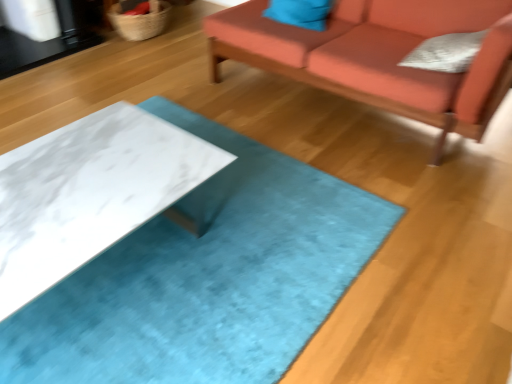
Question: Is matte blue pillow at upper center, which is the second pillow from right to left, closer to camera compared to white marble table at center?

Choices:
 (A) yes
 (B) no

Answer: (B)

Question: Does matte blue pillow at upper center, which appears as the 1th pillow when viewed from the left, appear on the right side of white marble table at center?

Choices:
 (A) no
 (B) yes

Answer: (B)

Question: Can you confirm if matte blue pillow at upper center, positioned as the 2th pillow in front-to-back order, is shorter than white marble table at center?

Choices:
 (A) yes
 (B) no

Answer: (A)

Question: Is matte blue pillow at upper center, which ranks as the first pillow in back-to-front order, behind white marble table at center?

Choices:
 (A) yes
 (B) no

Answer: (A)

Question: Is matte blue pillow at upper center, which is counted as the second pillow, starting from the bottom, oriented away from white marble table at center?

Choices:
 (A) no
 (B) yes

Answer: (A)

Question: From a real-world perspective, is matte blue pillow at upper center, which ranks as the first pillow in back-to-front order, on top of white marble table at center?

Choices:
 (A) no
 (B) yes

Answer: (B)

Question: Does white textured pillow at upper right, the 1th pillow positioned from the front, turn towards velvet orange couch at upper right?

Choices:
 (A) no
 (B) yes

Answer: (B)

Question: Considering the relative sizes of white textured pillow at upper right, which ranks as the 2th pillow in top-to-bottom order, and velvet orange couch at upper right in the image provided, is white textured pillow at upper right, which ranks as the 2th pillow in top-to-bottom order, wider than velvet orange couch at upper right?

Choices:
 (A) no
 (B) yes

Answer: (A)

Question: Would you say velvet orange couch at upper right is part of white textured pillow at upper right, the 2th pillow positioned from the left,'s contents?

Choices:
 (A) no
 (B) yes

Answer: (A)

Question: Is white textured pillow at upper right, which appears as the 1th pillow when ordered from the bottom, with velvet orange couch at upper right?

Choices:
 (A) no
 (B) yes

Answer: (A)

Question: Is white textured pillow at upper right, positioned as the second pillow in back-to-front order, thinner than velvet orange couch at upper right?

Choices:
 (A) yes
 (B) no

Answer: (A)

Question: From the image's perspective, is white textured pillow at upper right, which ranks as the 2th pillow in top-to-bottom order, located above velvet orange couch at upper right?

Choices:
 (A) yes
 (B) no

Answer: (B)

Question: Is matte blue pillow at upper center, which is the second pillow from right to left, outside velvet orange couch at upper right?

Choices:
 (A) no
 (B) yes

Answer: (A)